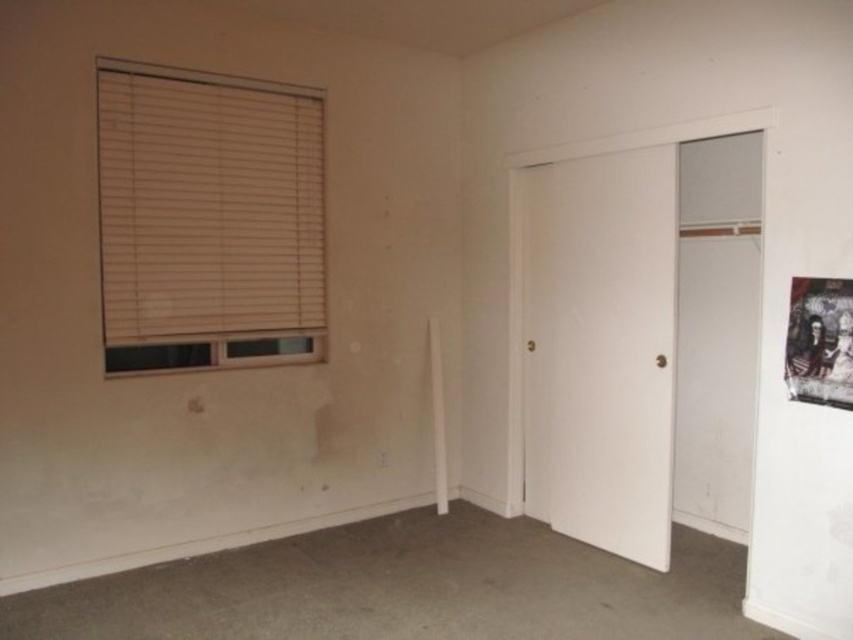
Question: Which of the following is the farthest from the observer?

Choices:
 (A) [813, 285]
 (B) [305, 90]

Answer: (B)

Question: Can you confirm if beige wood blinds at upper left is positioned below dark textured poster at upper right?

Choices:
 (A) yes
 (B) no

Answer: (B)

Question: Which object appears closest to the camera in this image?

Choices:
 (A) dark textured poster at upper right
 (B) beige wood blinds at upper left

Answer: (A)

Question: Does beige wood blinds at upper left appear on the right side of dark textured poster at upper right?

Choices:
 (A) yes
 (B) no

Answer: (B)

Question: In this image, where is beige wood blinds at upper left located relative to dark textured poster at upper right?

Choices:
 (A) above
 (B) below

Answer: (A)